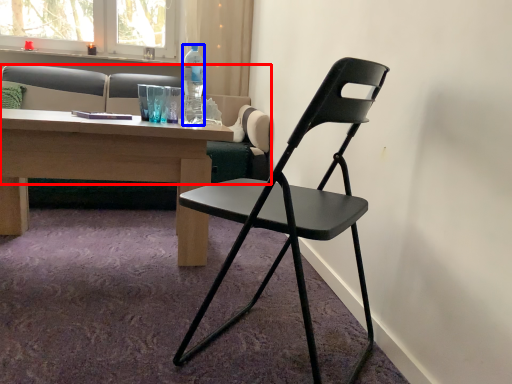
Question: Among these objects, which one is farthest to the camera, studio couch (highlighted by a red box) or bottle (highlighted by a blue box)?

Choices:
 (A) studio couch
 (B) bottle

Answer: (A)